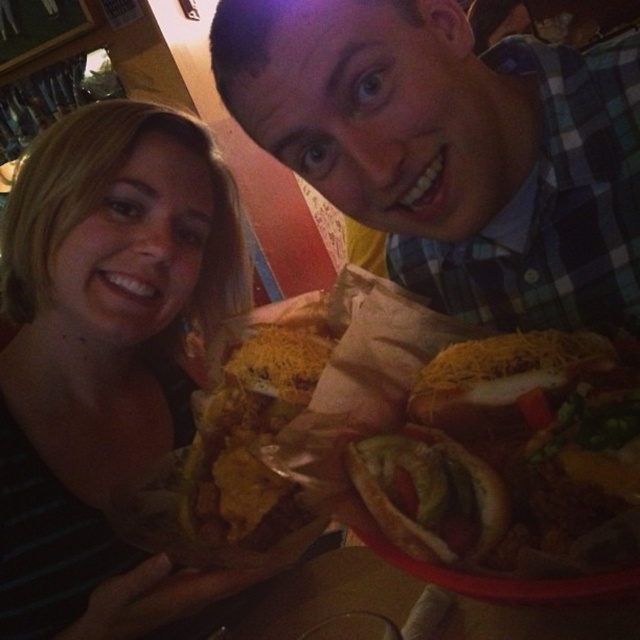
Question: Among these objects, which one is nearest to the camera?

Choices:
 (A) matte black shirt at lower left
 (B) golden shredded cheese hot dog at center
 (C) greenish-brown bun at center
 (D) green plaid shirt at upper right

Answer: (C)

Question: Is green plaid shirt at upper right smaller than matte black shirt at lower left?

Choices:
 (A) yes
 (B) no

Answer: (A)

Question: Which object is closer to the camera taking this photo?

Choices:
 (A) greenish-brown bun at center
 (B) matte black shirt at lower left
 (C) golden shredded cheese hot dog at center
 (D) green plaid shirt at upper right

Answer: (A)

Question: Among these objects, which one is nearest to the camera?

Choices:
 (A) matte black shirt at lower left
 (B) greenish-brown bun at center
 (C) green plaid shirt at upper right

Answer: (B)

Question: Does matte black shirt at lower left appear on the left side of greenish-brown bun at center?

Choices:
 (A) yes
 (B) no

Answer: (A)

Question: Is matte black shirt at lower left thinner than greenish-brown bun at center?

Choices:
 (A) yes
 (B) no

Answer: (B)